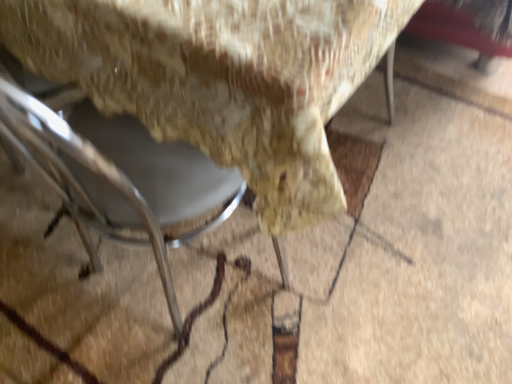
Looking at this image, measure the distance between metallic gray chair at lower left, which appears as the second chair when viewed from the left, and camera.

metallic gray chair at lower left, which appears as the second chair when viewed from the left, is 44.92 centimeters from camera.

The image size is (512, 384). What do you see at coordinates (221, 79) in the screenshot? I see `metallic gray chair at lower left, which appears as the second chair when viewed from the left` at bounding box center [221, 79].

The height and width of the screenshot is (384, 512). I want to click on metallic gray chair at lower left, which appears as the second chair when viewed from the left, so click(x=221, y=79).

The height and width of the screenshot is (384, 512). In order to click on metallic gray chair at lower left, the 1th chair when ordered from left to right in this screenshot , I will do `click(117, 177)`.

Describe the element at coordinates (117, 177) in the screenshot. I see `metallic gray chair at lower left, the second chair from the right` at that location.

What is the approximate width of metallic gray chair at lower left, the second chair from the right?

metallic gray chair at lower left, the second chair from the right, is 15.49 inches in width.

The width and height of the screenshot is (512, 384). In order to click on metallic gray chair at lower left, which is counted as the first chair, starting from the right in this screenshot , I will do `click(221, 79)`.

Is metallic gray chair at lower left, the 1th chair when ordered from left to right, at the left side of metallic gray chair at lower left, which appears as the second chair when viewed from the left?

Yes.

In the image, is metallic gray chair at lower left, the second chair from the right, positioned in front of or behind metallic gray chair at lower left, which appears as the second chair when viewed from the left?

metallic gray chair at lower left, the second chair from the right, is positioned closer to the viewer than metallic gray chair at lower left, which appears as the second chair when viewed from the left.

Which is in front, point (104, 219) or point (372, 13)?

Positioned in front is point (372, 13).

Looking at this image, from the image's perspective, between metallic gray chair at lower left, the second chair from the right, and metallic gray chair at lower left, which is counted as the first chair, starting from the right, who is located below?

metallic gray chair at lower left, the second chair from the right, is shown below in the image.

From a real-world perspective, relative to metallic gray chair at lower left, which is counted as the first chair, starting from the right, is metallic gray chair at lower left, the second chair from the right, vertically above or below?

In terms of real-world spatial position, metallic gray chair at lower left, the second chair from the right, is above metallic gray chair at lower left, which is counted as the first chair, starting from the right.

Considering the sizes of objects metallic gray chair at lower left, the second chair from the right, and metallic gray chair at lower left, which is counted as the first chair, starting from the right, in the image provided, who is thinner, metallic gray chair at lower left, the second chair from the right, or metallic gray chair at lower left, which is counted as the first chair, starting from the right,?

With smaller width is metallic gray chair at lower left, the second chair from the right.

Which of these two, metallic gray chair at lower left, the 1th chair when ordered from left to right, or metallic gray chair at lower left, which is counted as the first chair, starting from the right, stands taller?

Standing taller between the two is metallic gray chair at lower left, the 1th chair when ordered from left to right.

Between metallic gray chair at lower left, the 1th chair when ordered from left to right, and metallic gray chair at lower left, which is counted as the first chair, starting from the right, which one has smaller size?

Smaller between the two is metallic gray chair at lower left, the 1th chair when ordered from left to right.

Choose the correct answer: Is metallic gray chair at lower left, the 1th chair when ordered from left to right, inside metallic gray chair at lower left, which appears as the second chair when viewed from the left, or outside it?

metallic gray chair at lower left, the 1th chair when ordered from left to right, is contained in metallic gray chair at lower left, which appears as the second chair when viewed from the left.

Is metallic gray chair at lower left, the 1th chair when ordered from left to right, with metallic gray chair at lower left, which appears as the second chair when viewed from the left?

No, metallic gray chair at lower left, the 1th chair when ordered from left to right, is not making contact with metallic gray chair at lower left, which appears as the second chair when viewed from the left.

Is metallic gray chair at lower left, the second chair from the right, facing away from metallic gray chair at lower left, which appears as the second chair when viewed from the left?

Yes, metallic gray chair at lower left, the second chair from the right, is positioned with its back facing metallic gray chair at lower left, which appears as the second chair when viewed from the left.

What's the angular difference between metallic gray chair at lower left, the second chair from the right, and metallic gray chair at lower left, which is counted as the first chair, starting from the right,'s facing directions?

180 degrees separate the facing orientations of metallic gray chair at lower left, the second chair from the right, and metallic gray chair at lower left, which is counted as the first chair, starting from the right.

Measure the distance between metallic gray chair at lower left, the second chair from the right, and metallic gray chair at lower left, which is counted as the first chair, starting from the right.

The distance of metallic gray chair at lower left, the second chair from the right, from metallic gray chair at lower left, which is counted as the first chair, starting from the right, is 8.00 inches.

Find the location of `chair above the metallic gray chair at lower left, the 1th chair when ordered from left to right (from the image's perspective)`. chair above the metallic gray chair at lower left, the 1th chair when ordered from left to right (from the image's perspective) is located at coordinates (221, 79).

Considering the positions of objects metallic gray chair at lower left, which is counted as the first chair, starting from the right, and metallic gray chair at lower left, the second chair from the right, in the image provided, who is more to the left, metallic gray chair at lower left, which is counted as the first chair, starting from the right, or metallic gray chair at lower left, the second chair from the right,?

Positioned to the left is metallic gray chair at lower left, the second chair from the right.

Is metallic gray chair at lower left, which is counted as the first chair, starting from the right, positioned before metallic gray chair at lower left, the second chair from the right?

No, it is behind metallic gray chair at lower left, the second chair from the right.

Is point (71, 17) in front of point (120, 127)?

That is True.

From the image's perspective, is metallic gray chair at lower left, which is counted as the first chair, starting from the right, on metallic gray chair at lower left, the second chair from the right?

Indeed, from the image's perspective, metallic gray chair at lower left, which is counted as the first chair, starting from the right, is shown above metallic gray chair at lower left, the second chair from the right.

In the scene shown: From a real-world perspective, who is located higher, metallic gray chair at lower left, which is counted as the first chair, starting from the right, or metallic gray chair at lower left, the 1th chair when ordered from left to right?

metallic gray chair at lower left, the 1th chair when ordered from left to right, from a real-world perspective.

Looking at their sizes, would you say metallic gray chair at lower left, which appears as the second chair when viewed from the left, is wider or thinner than metallic gray chair at lower left, the second chair from the right?

Clearly, metallic gray chair at lower left, which appears as the second chair when viewed from the left, has more width compared to metallic gray chair at lower left, the second chair from the right.

Is metallic gray chair at lower left, which appears as the second chair when viewed from the left, taller than metallic gray chair at lower left, the second chair from the right?

In fact, metallic gray chair at lower left, which appears as the second chair when viewed from the left, may be shorter than metallic gray chair at lower left, the second chair from the right.

Considering the relative sizes of metallic gray chair at lower left, which is counted as the first chair, starting from the right, and metallic gray chair at lower left, the second chair from the right, in the image provided, is metallic gray chair at lower left, which is counted as the first chair, starting from the right, smaller than metallic gray chair at lower left, the second chair from the right,?

Incorrect, metallic gray chair at lower left, which is counted as the first chair, starting from the right, is not smaller in size than metallic gray chair at lower left, the second chair from the right.

Is metallic gray chair at lower left, which is counted as the first chair, starting from the right, inside or outside of metallic gray chair at lower left, the 1th chair when ordered from left to right?

metallic gray chair at lower left, which is counted as the first chair, starting from the right, cannot be found inside metallic gray chair at lower left, the 1th chair when ordered from left to right.

Can you see metallic gray chair at lower left, which is counted as the first chair, starting from the right, touching metallic gray chair at lower left, the 1th chair when ordered from left to right?

No, metallic gray chair at lower left, which is counted as the first chair, starting from the right, is not with metallic gray chair at lower left, the 1th chair when ordered from left to right.

Is metallic gray chair at lower left, the 1th chair when ordered from left to right, at the back of metallic gray chair at lower left, which appears as the second chair when viewed from the left?

Yes, metallic gray chair at lower left, the 1th chair when ordered from left to right, is at the back of metallic gray chair at lower left, which appears as the second chair when viewed from the left.

What's the angular difference between metallic gray chair at lower left, which is counted as the first chair, starting from the right, and metallic gray chair at lower left, the 1th chair when ordered from left to right,'s facing directions?

180 degrees separate the facing orientations of metallic gray chair at lower left, which is counted as the first chair, starting from the right, and metallic gray chair at lower left, the 1th chair when ordered from left to right.

Identify the location of chair in front of the metallic gray chair at lower left, which is counted as the first chair, starting from the right. (117, 177).

Image resolution: width=512 pixels, height=384 pixels. Find the location of `chair in front of the metallic gray chair at lower left, which appears as the second chair when viewed from the left`. chair in front of the metallic gray chair at lower left, which appears as the second chair when viewed from the left is located at coordinates (117, 177).

Where is `chair on the right of metallic gray chair at lower left, the second chair from the right`? chair on the right of metallic gray chair at lower left, the second chair from the right is located at coordinates (221, 79).